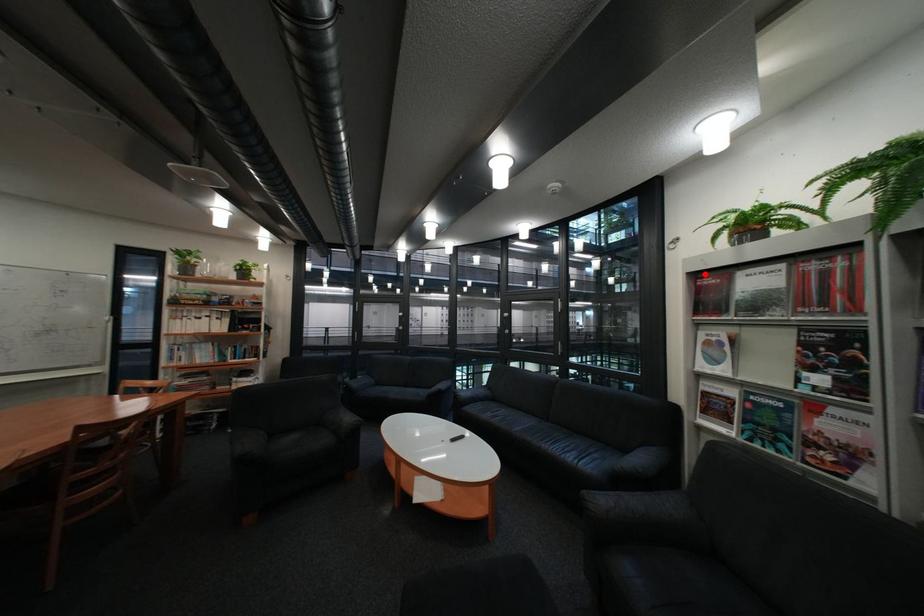
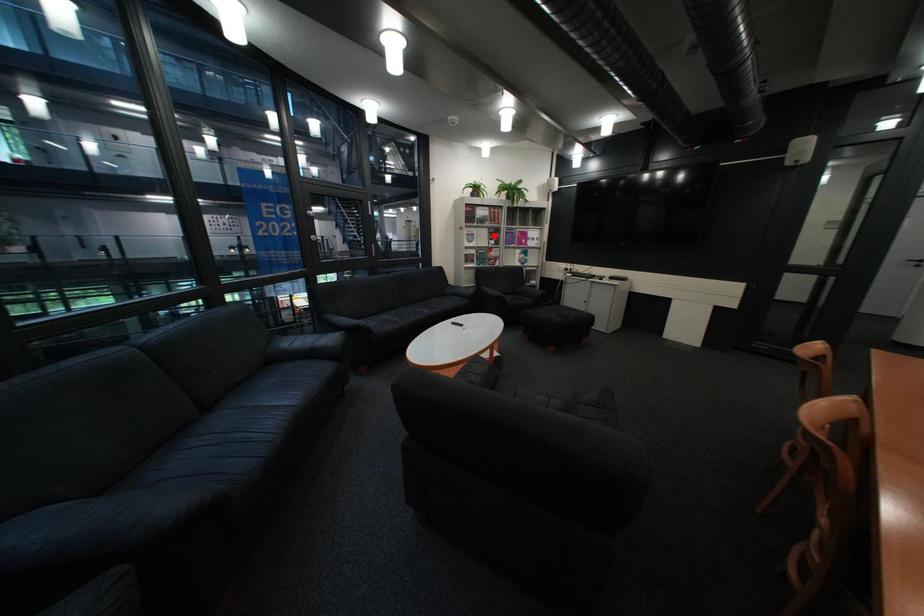
I am providing you with two images of the same scene from different viewpoints. A red point is marked on the first image and another point is marked on the second image. Is the marked point in image1 the same physical position as the marked point in image2?

No